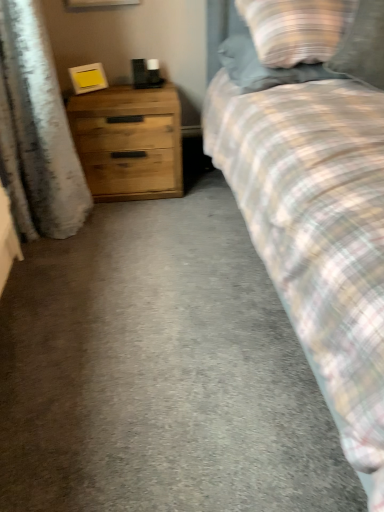
Identify the location of wooden chest of drawers at left. (129, 141).

Describe the element at coordinates (37, 130) in the screenshot. I see `white textured curtain at left` at that location.

In the scene shown: How much space does plaid fabric pillow at upper right, marked as the first pillow in a left-to-right arrangement, occupy vertically?

The height of plaid fabric pillow at upper right, marked as the first pillow in a left-to-right arrangement, is 13.77 inches.

Measure the distance between point [358,62] and camera.

Point [358,62] and camera are 1.51 meters apart.

Locate an element on the screen. wooden chest of drawers at left is located at coordinates (129, 141).

Identify the location of curtain to the left of wooden chest of drawers at left. This screenshot has width=384, height=512. [37, 130].

Is wooden chest of drawers at left oriented away from white textured curtain at left?

No, wooden chest of drawers at left is not facing away from white textured curtain at left.

Is wooden chest of drawers at left thinner than white textured curtain at left?

Incorrect, the width of wooden chest of drawers at left is not less than that of white textured curtain at left.

Which is less distant, (x=147, y=106) or (x=80, y=184)?

Point (x=147, y=106)

How far apart are white textured curtain at left and wooden chest of drawers at left?

They are 11.20 inches apart.

Considering the positions of objects white textured curtain at left and wooden chest of drawers at left in the image provided, who is behind, white textured curtain at left or wooden chest of drawers at left?

wooden chest of drawers at left is behind.

Is wooden chest of drawers at left at the back of white textured curtain at left?

No, wooden chest of drawers at left is not at the back of white textured curtain at left.

Is white textured curtain at left to the left of wooden chest of drawers at left from the viewer's perspective?

Yes, white textured curtain at left is to the left of wooden chest of drawers at left.

Which is closer, [26,70] or [366,9]?

The point [366,9] is closer to the camera.

Is white textured curtain at left at the right side of plaid fabric pillow at upper right, the first pillow from the right?

Incorrect, white textured curtain at left is not on the right side of plaid fabric pillow at upper right, the first pillow from the right.

Who is taller, white textured curtain at left or plaid fabric pillow at upper right, the first pillow from the right?

With more height is white textured curtain at left.

From a real-world perspective, relative to plaid fabric pillow at upper right, the first pillow from the right, is white textured curtain at left vertically above or below?

From a real-world perspective, white textured curtain at left is physically below plaid fabric pillow at upper right, the first pillow from the right.

Is plaid fabric pillow at upper right, which is the second pillow in left-to-right order, in contact with white textured curtain at left?

No.

Does point (365, 49) come farther from viewer compared to point (78, 224)?

No.

I want to click on curtain in front of the plaid fabric pillow at upper right, which is the second pillow in left-to-right order, so 37,130.

Which object is more forward, plaid fabric pillow at upper right, the first pillow from the right, or white textured curtain at left?

white textured curtain at left is closer to the camera.

Is plaid fabric pillow at upper right, which is the second pillow in left-to-right order, wider than wooden chest of drawers at left?

No.

Looking at this image, from a real-world perspective, is plaid fabric pillow at upper right, which is the second pillow in left-to-right order, over wooden chest of drawers at left?

Yes, from a real-world perspective, plaid fabric pillow at upper right, which is the second pillow in left-to-right order, is above wooden chest of drawers at left.

Is plaid fabric pillow at upper right, which is the second pillow in left-to-right order, turned away from wooden chest of drawers at left?

plaid fabric pillow at upper right, which is the second pillow in left-to-right order, is not turned away from wooden chest of drawers at left.

From the picture: Visually, is white textured curtain at left positioned to the left or to the right of plaid fabric pillow at upper right, acting as the second pillow starting from the right?

white textured curtain at left is positioned on plaid fabric pillow at upper right, acting as the second pillow starting from the right,'s left side.

Consider the image. Is white textured curtain at left situated inside plaid fabric pillow at upper right, acting as the second pillow starting from the right, or outside?

white textured curtain at left is not enclosed by plaid fabric pillow at upper right, acting as the second pillow starting from the right.

Is plaid fabric pillow at upper right, acting as the second pillow starting from the right, at the back of white textured curtain at left?

No, plaid fabric pillow at upper right, acting as the second pillow starting from the right, is not at the back of white textured curtain at left.

From the image's perspective, relative to plaid fabric pillow at upper right, acting as the second pillow starting from the right, is white textured curtain at left above or below?

white textured curtain at left is situated lower than plaid fabric pillow at upper right, acting as the second pillow starting from the right, in the image.

Do you think wooden chest of drawers at left is within plaid fabric pillow at upper right, acting as the second pillow starting from the right, or outside of it?

wooden chest of drawers at left exists outside the volume of plaid fabric pillow at upper right, acting as the second pillow starting from the right.

From the image's perspective, is wooden chest of drawers at left on plaid fabric pillow at upper right, acting as the second pillow starting from the right?

No, from the image's perspective, wooden chest of drawers at left is not above plaid fabric pillow at upper right, acting as the second pillow starting from the right.

Considering the sizes of objects wooden chest of drawers at left and plaid fabric pillow at upper right, acting as the second pillow starting from the right, in the image provided, who is bigger, wooden chest of drawers at left or plaid fabric pillow at upper right, acting as the second pillow starting from the right,?

plaid fabric pillow at upper right, acting as the second pillow starting from the right.

Which is more to the left, wooden chest of drawers at left or plaid fabric pillow at upper right, acting as the second pillow starting from the right?

Positioned to the left is wooden chest of drawers at left.

Find the location of a particular element. the chest of drawers located behind the white textured curtain at left is located at coordinates (129, 141).

There is a wooden chest of drawers at left. Where is `curtain above it (from a real-world perspective)`? The width and height of the screenshot is (384, 512). curtain above it (from a real-world perspective) is located at coordinates (37, 130).

When comparing their distances from plaid fabric pillow at upper right, marked as the first pillow in a left-to-right arrangement, does wooden chest of drawers at left or white textured curtain at left seem closer?

wooden chest of drawers at left is positioned closer to the anchor plaid fabric pillow at upper right, marked as the first pillow in a left-to-right arrangement.

When comparing their distances from plaid fabric pillow at upper right, the first pillow from the right, does wooden chest of drawers at left or plaid fabric pillow at upper right, marked as the first pillow in a left-to-right arrangement, seem closer?

plaid fabric pillow at upper right, marked as the first pillow in a left-to-right arrangement, lies closer to plaid fabric pillow at upper right, the first pillow from the right, than the other object.

Considering their positions, is white textured curtain at left positioned further to plaid fabric pillow at upper right, the first pillow from the right, than wooden chest of drawers at left?

white textured curtain at left lies further to plaid fabric pillow at upper right, the first pillow from the right, than the other object.

Based on their spatial positions, is white textured curtain at left or plaid fabric pillow at upper right, the first pillow from the right, further from wooden chest of drawers at left?

Based on the image, plaid fabric pillow at upper right, the first pillow from the right, appears to be further to wooden chest of drawers at left.

Looking at the image, which one is located closer to white textured curtain at left, plaid fabric pillow at upper right, which is the second pillow in left-to-right order, or plaid fabric pillow at upper right, acting as the second pillow starting from the right?

plaid fabric pillow at upper right, acting as the second pillow starting from the right.

Consider the image. When comparing their distances from plaid fabric pillow at upper right, marked as the first pillow in a left-to-right arrangement, does plaid fabric pillow at upper right, the first pillow from the right, or wooden chest of drawers at left seem closer?

plaid fabric pillow at upper right, the first pillow from the right.

Based on their spatial positions, is wooden chest of drawers at left or plaid fabric pillow at upper right, which is the second pillow in left-to-right order, further from plaid fabric pillow at upper right, acting as the second pillow starting from the right?

Based on the image, wooden chest of drawers at left appears to be further to plaid fabric pillow at upper right, acting as the second pillow starting from the right.

From the image, which object appears to be farther from plaid fabric pillow at upper right, marked as the first pillow in a left-to-right arrangement, plaid fabric pillow at upper right, the first pillow from the right, or white textured curtain at left?

Among the two, white textured curtain at left is located further to plaid fabric pillow at upper right, marked as the first pillow in a left-to-right arrangement.

Identify the location of pillow between white textured curtain at left and plaid fabric pillow at upper right, which is the second pillow in left-to-right order, from left to right. (296, 29).

You are a GUI agent. You are given a task and a screenshot of the screen. Output one action in this format:
    pyautogui.click(x=<x>, y=<y>)
    Task: Click on the chest of drawers situated between white textured curtain at left and plaid fabric pillow at upper right, which is the second pillow in left-to-right order, from left to right
    The image size is (384, 512).
    Given the screenshot: What is the action you would take?
    pyautogui.click(x=129, y=141)

This screenshot has height=512, width=384. I want to click on pillow between wooden chest of drawers at left and plaid fabric pillow at upper right, the first pillow from the right, from left to right, so click(x=296, y=29).

This screenshot has width=384, height=512. I want to click on chest of drawers between white textured curtain at left and plaid fabric pillow at upper right, marked as the first pillow in a left-to-right arrangement, from left to right, so click(x=129, y=141).